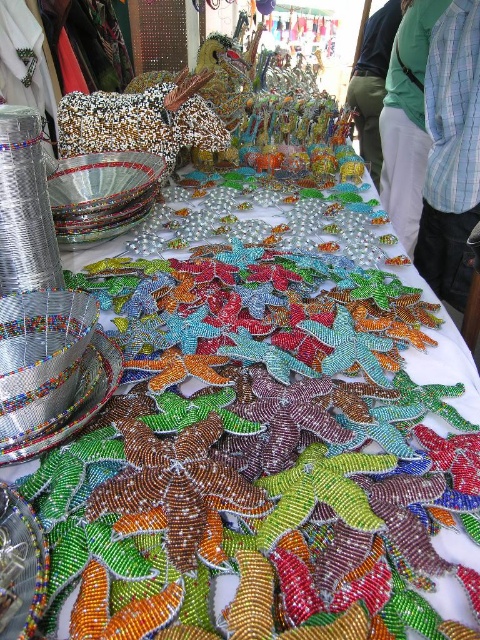
You are a customer at the beadwork market and want to buy a piece from the table. You are standing at the point indicated by the coordinates point (451, 154). Based on your position, which direction should you move to reach the beadwork on the table?

The point (451, 154) corresponds to the blue plaid shirt at upper right. Since the beadwork is on the table, you should move downward from the blue plaid shirt at upper right to reach the beadwork on the table.

Based on the photo, you are a customer at the beadwork market and want to place a small decorative item on the table between the blue plaid shirt at upper right and the green fabric pants at center. If the item is 3 feet long, will it fit between them?

The blue plaid shirt at upper right is 5.63 feet from the green fabric pants at center. Since the item is only 3 feet long, it will fit comfortably between them.

You are a customer at the market looking at the beadwork. You see the green fabric at upper center and the green fabric pants at center. Which item is located to the right of the other?

The green fabric at upper center is positioned on the right side of green fabric pants at center, so the green fabric at upper center is to the right of the green fabric pants at center.